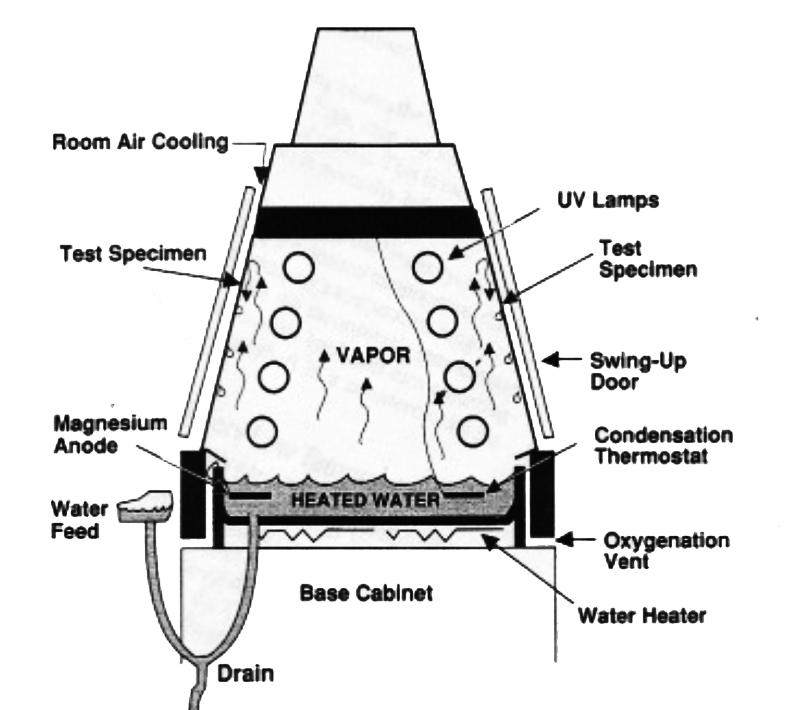
Find the location of a particular element. black shade is located at coordinates coord(431,226).